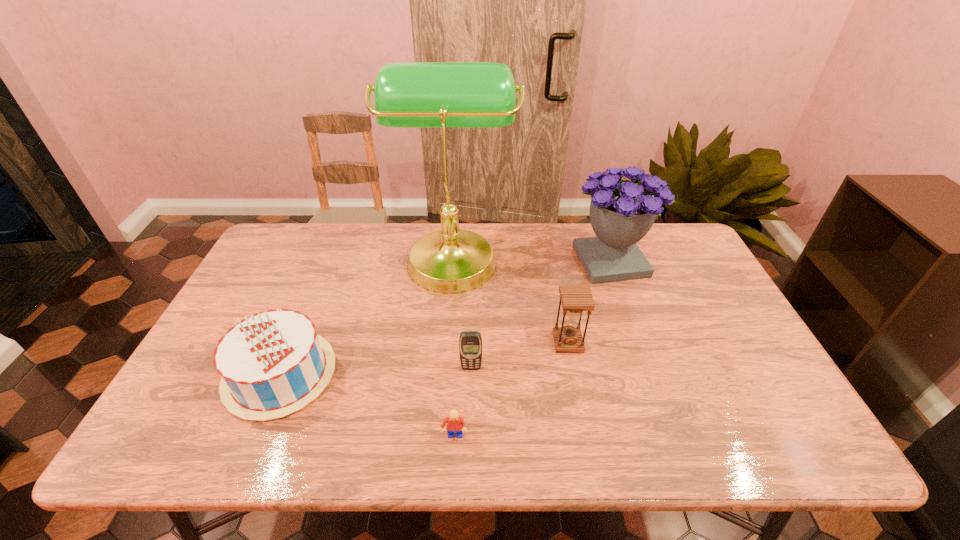
Where is `blank space at the near edge`? The image size is (960, 540). blank space at the near edge is located at coordinates (652, 451).

This screenshot has height=540, width=960. Identify the location of free space at the left edge. (254, 285).

In the image, there is a desktop. Identify the location of free space at the right edge. Image resolution: width=960 pixels, height=540 pixels. (675, 300).

Identify the location of vacant space at the near left corner. (204, 427).

Find the location of `free point between the shortest object and the birthday cake`. free point between the shortest object and the birthday cake is located at coordinates (367, 406).

The image size is (960, 540). Find the location of `free point between the shortest object and the hourglass`. free point between the shortest object and the hourglass is located at coordinates (511, 389).

The image size is (960, 540). Find the location of `empty location between the shortest object and the rightmost object`. empty location between the shortest object and the rightmost object is located at coordinates (532, 349).

Find the location of a particular element. The width and height of the screenshot is (960, 540). free area in between the tallest object and the second object from right to left is located at coordinates (510, 299).

You are a GUI agent. You are given a task and a screenshot of the screen. Output one action in this format:
    pyautogui.click(x=<x>, y=<y>)
    Task: Click on the empty location between the tallest object and the nearest object
    Image resolution: width=960 pixels, height=540 pixels.
    Given the screenshot: What is the action you would take?
    pyautogui.click(x=453, y=347)

Image resolution: width=960 pixels, height=540 pixels. I want to click on blank region between the birthday cake and the hourglass, so click(x=424, y=358).